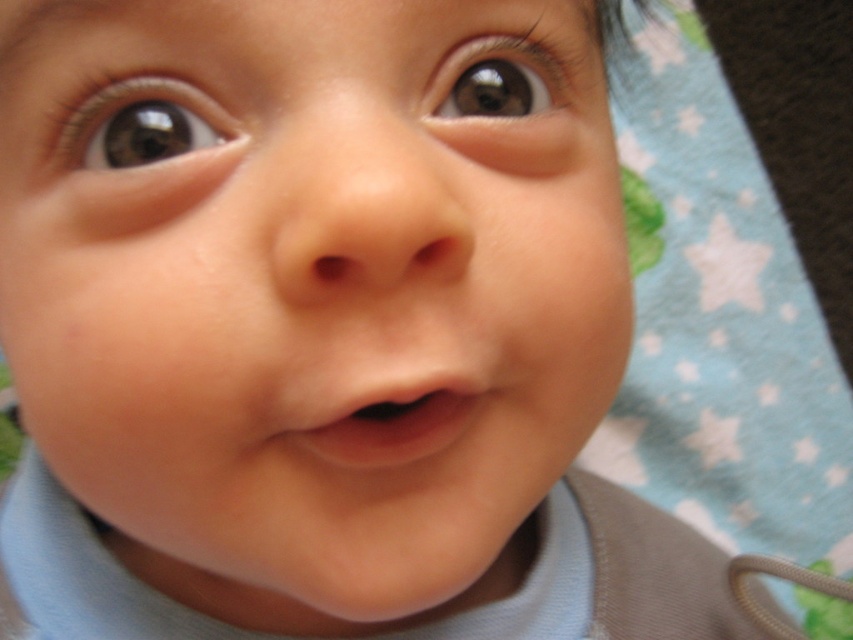
Consider the image. You are a photographer taking a close up of a baby. You notice the smooth skin baby face at center and the pink smooth flesh at center. Which one is located lower in the image?

The smooth skin baby face at center is positioned under the pink smooth flesh at center, so the smooth skin baby face at center is located lower in the image.

What are the coordinates of the smooth skin baby face at center?

The smooth skin baby face at center is located at point (x=306, y=298).